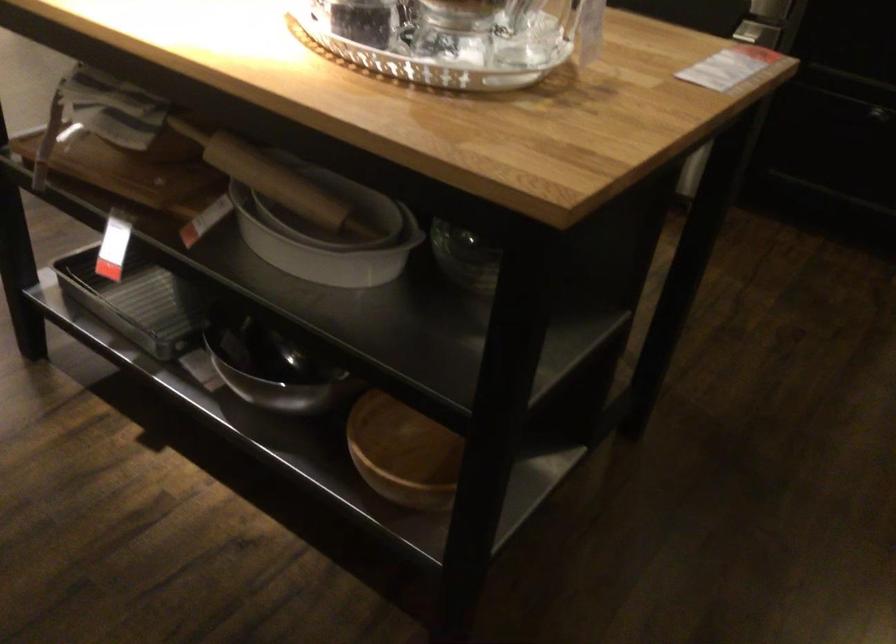
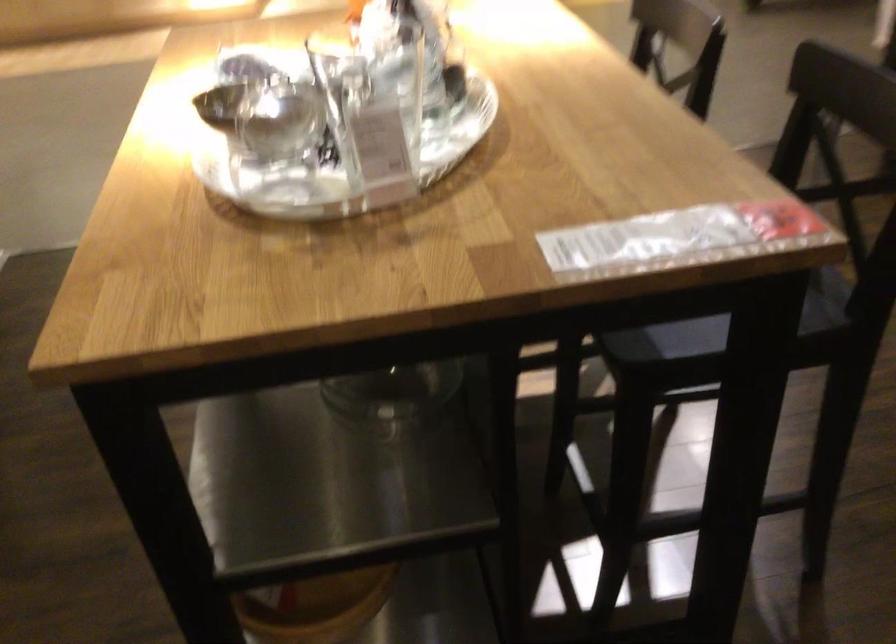
Where in the second image is the point corresponding to pixel 737 69 from the first image?

(676, 238)